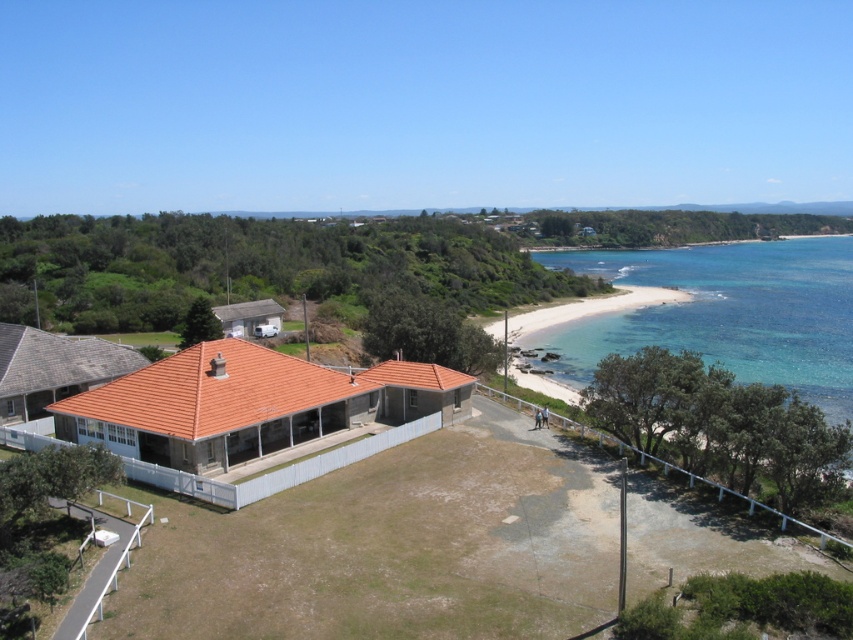
Is point (257, 422) in front of point (755, 280)?

Yes, point (257, 422) is closer to viewer.

Who is positioned more to the right, terracotta tiled house at center or clear blue water at beach right?

Positioned to the right is clear blue water at beach right.

Which is behind, point (202, 372) or point (746, 275)?

Positioned behind is point (746, 275).

The height and width of the screenshot is (640, 853). Find the location of `terracotta tiled house at center`. terracotta tiled house at center is located at coordinates (247, 417).